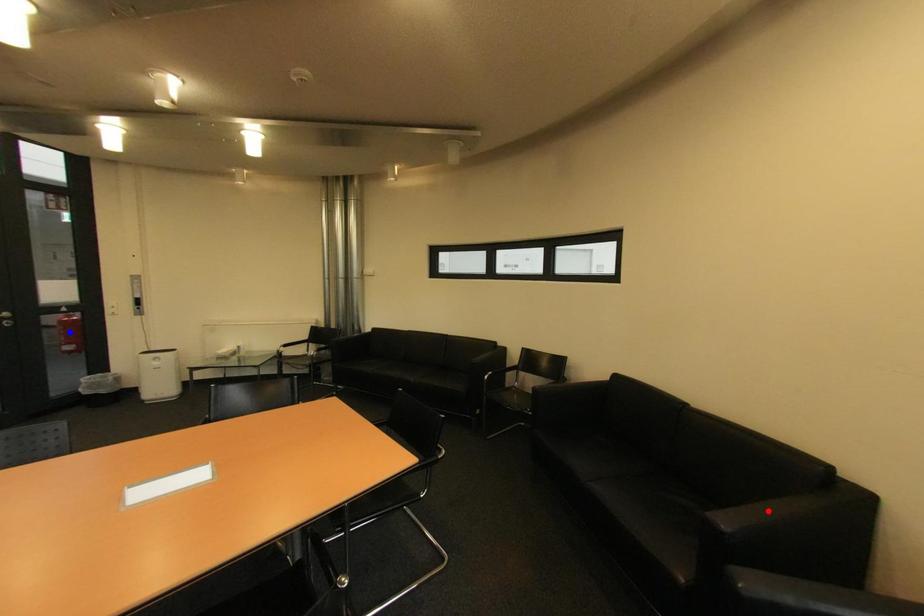
Question: In the image, two points are highlighted. Which point is nearer to the camera? Reply with the corresponding letter.

Choices:
 (A) blue point
 (B) red point

Answer: (B)